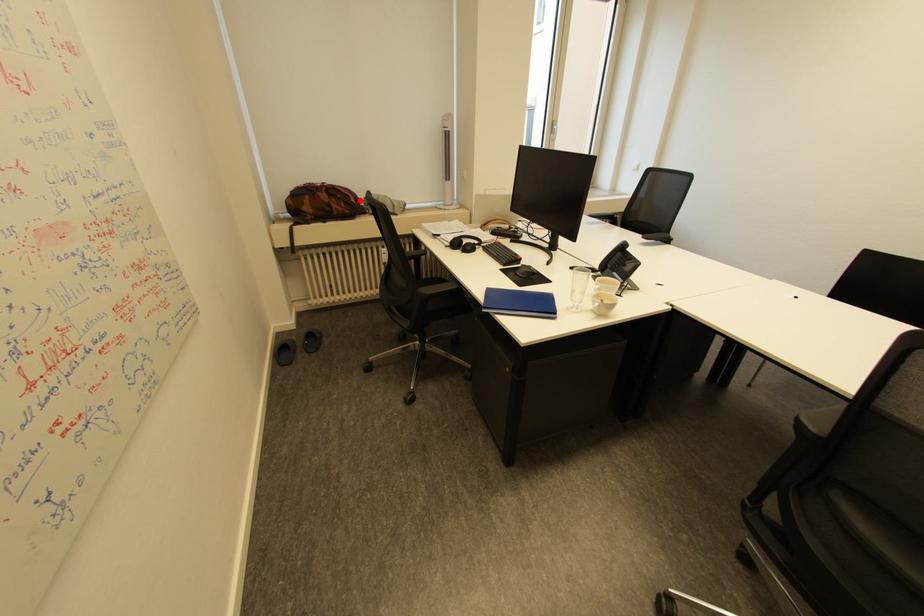
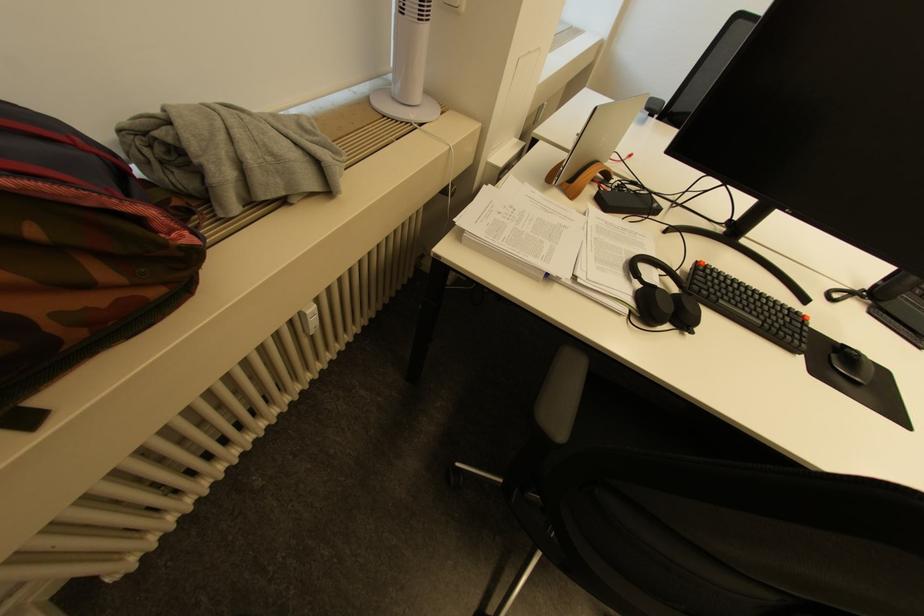
Find the pixel in the second image that matches the highlighted location in the first image.

(196, 238)